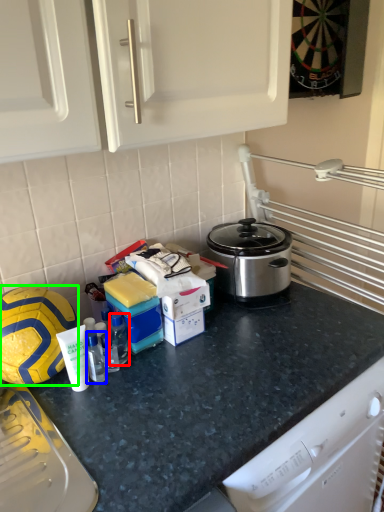
Question: Considering the real-world distances, which object is farthest from bottle (highlighted by a red box)? bottle (highlighted by a blue box) or football (highlighted by a green box)?

Choices:
 (A) bottle
 (B) football

Answer: (B)